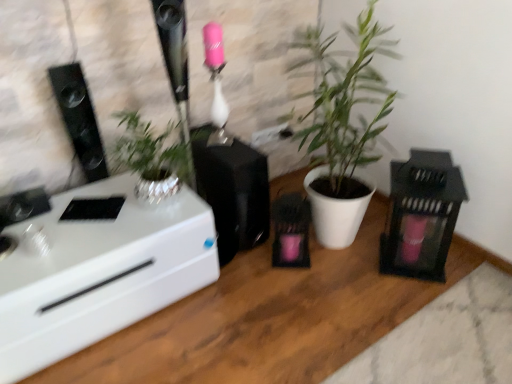
Find the location of a particular element. black matte speaker at center, which is counted as the first appliance, starting from the left is located at coordinates (233, 191).

Where is `white matte plant pot at center`? Image resolution: width=512 pixels, height=384 pixels. white matte plant pot at center is located at coordinates (342, 124).

Where is `black matte speaker at center, which is counted as the first appliance, starting from the left`? The height and width of the screenshot is (384, 512). black matte speaker at center, which is counted as the first appliance, starting from the left is located at coordinates (233, 191).

In terms of size, does white glossy desk at left appear bigger or smaller than black matte lantern at right, which is the 2th appliance from left to right?

Considering their sizes, white glossy desk at left takes up more space than black matte lantern at right, which is the 2th appliance from left to right.

Does point (143, 298) come closer to viewer compared to point (456, 200)?

Yes, it is.

Is black matte lantern at right, arranged as the first appliance when viewed from the right, surrounded by white glossy desk at left?

No.

Between white glossy desk at left and black matte lantern at right, arranged as the first appliance when viewed from the right, which one appears on the right side from the viewer's perspective?

Positioned to the right is black matte lantern at right, arranged as the first appliance when viewed from the right.

Considering the positions of points (329, 203) and (6, 233), is point (329, 203) closer to camera compared to point (6, 233)?

No, it is behind (6, 233).

Consider the image. Is white matte plant pot at center positioned beyond the bounds of white glossy desk at left?

Yes, white matte plant pot at center is not within white glossy desk at left.

The image size is (512, 384). I want to click on desk in front of the white matte plant pot at center, so click(x=98, y=271).

Is white matte plant pot at center to the left of white glossy desk at left from the viewer's perspective?

Incorrect, white matte plant pot at center is not on the left side of white glossy desk at left.

Are black glossy speaker at left and white matte plant pot at center located far from each other?

No, black glossy speaker at left is not far away from white matte plant pot at center.

From a real-world perspective, who is located higher, black glossy speaker at left or white matte plant pot at center?

In real-world perspective, black glossy speaker at left is above.

Identify the location of houseplant on the right of black glossy speaker at left. (342, 124).

From the image's perspective, is black glossy speaker at left above or below white matte plant pot at center?

From the image's perspective, black glossy speaker at left appears below white matte plant pot at center.

Would you say black matte speaker at center, arranged as the second appliance when viewed from the right, is outside black glossy speaker at left?

black matte speaker at center, arranged as the second appliance when viewed from the right, lies outside black glossy speaker at left's area.

Are black matte speaker at center, which is counted as the first appliance, starting from the left, and black glossy speaker at left beside each other?

No, black matte speaker at center, which is counted as the first appliance, starting from the left, is not beside black glossy speaker at left.

Is black matte speaker at center, which is counted as the first appliance, starting from the left, aimed at black glossy speaker at left?

No, black matte speaker at center, which is counted as the first appliance, starting from the left, is not aimed at black glossy speaker at left.

This screenshot has width=512, height=384. In order to click on the 1st appliance to the right of the black glossy speaker at left, counting from the anchor's position in this screenshot , I will do `click(233, 191)`.

Does black glossy speaker at left appear on the left side of black matte speaker at center, arranged as the second appliance when viewed from the right?

Yes, black glossy speaker at left is to the left of black matte speaker at center, arranged as the second appliance when viewed from the right.

Between black glossy speaker at left and black matte speaker at center, arranged as the second appliance when viewed from the right, which one has less height?

Standing shorter between the two is black matte speaker at center, arranged as the second appliance when viewed from the right.

Are black glossy speaker at left and black matte speaker at center, arranged as the second appliance when viewed from the right, making contact?

black glossy speaker at left is not next to black matte speaker at center, arranged as the second appliance when viewed from the right, and they're not touching.

The height and width of the screenshot is (384, 512). Identify the location of the 1st appliance below the white matte plant pot at center (from a real-world perspective). (421, 215).

Would you say white matte plant pot at center contains black matte lantern at right, which is the 2th appliance from left to right?

No.

Considering the relative sizes of white matte plant pot at center and black matte lantern at right, which is the 2th appliance from left to right, in the image provided, is white matte plant pot at center bigger than black matte lantern at right, which is the 2th appliance from left to right,?

Yes.

How different are the orientations of white matte plant pot at center and black matte lantern at right, which is the 2th appliance from left to right, in degrees?

The angle between the facing direction of white matte plant pot at center and the facing direction of black matte lantern at right, which is the 2th appliance from left to right, is 48.2 degrees.

Between black matte lantern at right, which is the 2th appliance from left to right, and white matte plant pot at center, which one is positioned in front?

white matte plant pot at center is more forward.

Does black matte lantern at right, which is the 2th appliance from left to right, turn towards white matte plant pot at center?

No.

From the image's perspective, which one is positioned lower, black matte lantern at right, which is the 2th appliance from left to right, or white matte plant pot at center?

black matte lantern at right, which is the 2th appliance from left to right, appears lower in the image.

You are a GUI agent. You are given a task and a screenshot of the screen. Output one action in this format:
    pyautogui.click(x=<x>, y=<y>)
    Task: Click on the desk in front of the black matte lantern at right, which is the 2th appliance from left to right
    
    Given the screenshot: What is the action you would take?
    pyautogui.click(x=98, y=271)

The image size is (512, 384). Identify the location of desk on the left of white matte plant pot at center. (98, 271).

When comparing their distances from black matte speaker at center, arranged as the second appliance when viewed from the right, does black matte lantern at right, which is the 2th appliance from left to right, or white matte plant pot at center seem further?

black matte lantern at right, which is the 2th appliance from left to right, is positioned further to the anchor black matte speaker at center, arranged as the second appliance when viewed from the right.

Based on their spatial positions, is black matte speaker at center, arranged as the second appliance when viewed from the right, or white glossy desk at left further from black glossy speaker at left?

black matte speaker at center, arranged as the second appliance when viewed from the right, is positioned further to the anchor black glossy speaker at left.

Looking at the image, which one is located further to black matte lantern at right, arranged as the first appliance when viewed from the right, black glossy speaker at left or white matte plant pot at center?

Among the two, black glossy speaker at left is located further to black matte lantern at right, arranged as the first appliance when viewed from the right.

Looking at the image, which one is located further to white glossy desk at left, black matte lantern at right, which is the 2th appliance from left to right, or black matte speaker at center, which is counted as the first appliance, starting from the left?

Based on the image, black matte lantern at right, which is the 2th appliance from left to right, appears to be further to white glossy desk at left.

Looking at the image, which one is located closer to white glossy desk at left, black matte speaker at center, which is counted as the first appliance, starting from the left, or white matte plant pot at center?

black matte speaker at center, which is counted as the first appliance, starting from the left, lies closer to white glossy desk at left than the other object.

When comparing their distances from white matte plant pot at center, does black matte lantern at right, arranged as the first appliance when viewed from the right, or black matte speaker at center, arranged as the second appliance when viewed from the right, seem closer?

Based on the image, black matte lantern at right, arranged as the first appliance when viewed from the right, appears to be nearer to white matte plant pot at center.

Considering their positions, is black glossy speaker at left positioned closer to black matte speaker at center, arranged as the second appliance when viewed from the right, than white glossy desk at left?

white glossy desk at left.

From the picture: From the image, which object appears to be farther from black matte speaker at center, arranged as the second appliance when viewed from the right, black glossy speaker at left or black matte lantern at right, arranged as the first appliance when viewed from the right?

Among the two, black matte lantern at right, arranged as the first appliance when viewed from the right, is located further to black matte speaker at center, arranged as the second appliance when viewed from the right.

Where is `houseplant situated between black glossy speaker at left and black matte lantern at right, arranged as the first appliance when viewed from the right, from left to right`? houseplant situated between black glossy speaker at left and black matte lantern at right, arranged as the first appliance when viewed from the right, from left to right is located at coordinates (342, 124).

The image size is (512, 384). In order to click on desk between black glossy speaker at left and white matte plant pot at center from left to right in this screenshot , I will do `click(98, 271)`.

Find the location of a particular element. houseplant between black matte speaker at center, arranged as the second appliance when viewed from the right, and black matte lantern at right, which is the 2th appliance from left to right, in the horizontal direction is located at coordinates (342, 124).

This screenshot has height=384, width=512. In order to click on desk between black glossy speaker at left and black matte lantern at right, arranged as the first appliance when viewed from the right, from left to right in this screenshot , I will do `click(98, 271)`.